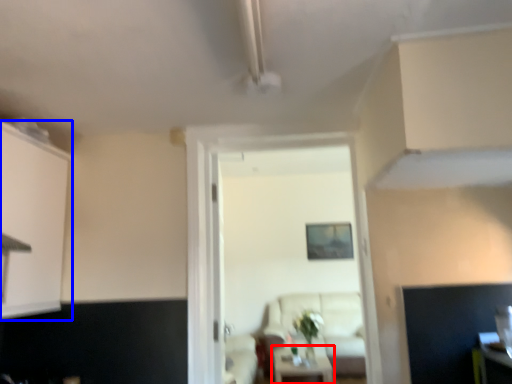
Question: Among these objects, which one is nearest to the camera, table (highlighted by a red box) or cabinetry (highlighted by a blue box)?

Choices:
 (A) table
 (B) cabinetry

Answer: (B)